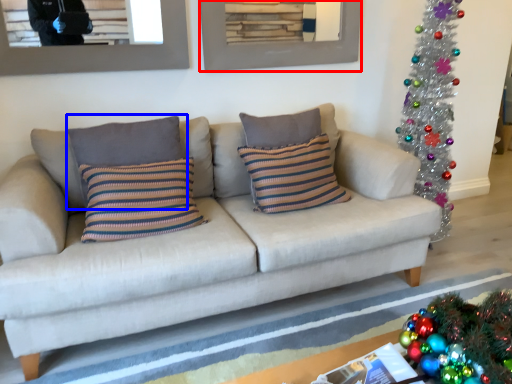
Question: Which object is further to the camera taking this photo, picture frame (highlighted by a red box) or pillow (highlighted by a blue box)?

Choices:
 (A) picture frame
 (B) pillow

Answer: (A)